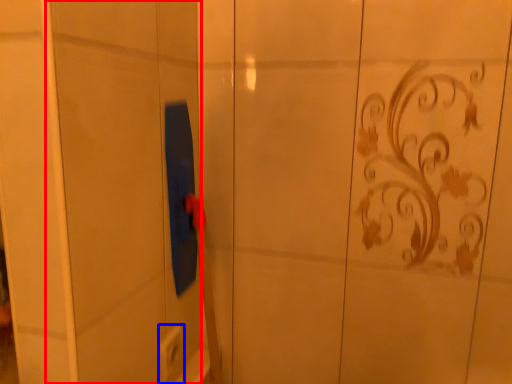
Question: Which of the following is the farthest to the observer, screen door (highlighted by a red box) or electric outlet (highlighted by a blue box)?

Choices:
 (A) screen door
 (B) electric outlet

Answer: (B)